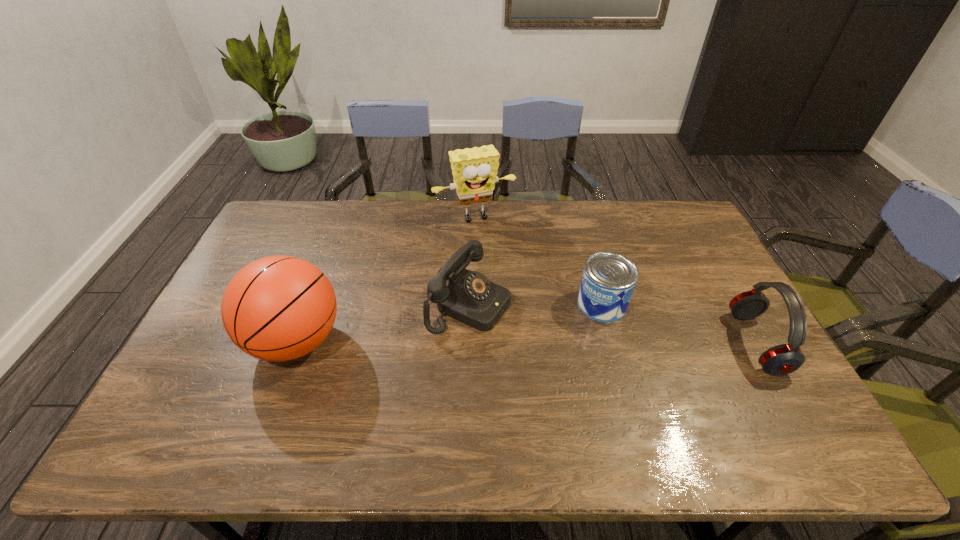
Locate an element on the screen. The width and height of the screenshot is (960, 540). vacant space on the desktop that is between the leftmost object and the earphone and is positioned on the dial of the telephone is located at coordinates (559, 342).

You are a GUI agent. You are given a task and a screenshot of the screen. Output one action in this format:
    pyautogui.click(x=<x>, y=<y>)
    Task: Click on the vacant space on the desktop that is between the basketball and the earphone and is positioned on the front-facing side of the farthest object
    The height and width of the screenshot is (540, 960).
    Given the screenshot: What is the action you would take?
    pyautogui.click(x=536, y=342)

Where is `vacant space on the desktop that is between the leftmost object and the rightmost object and is positioned on the front label of the can`? The image size is (960, 540). vacant space on the desktop that is between the leftmost object and the rightmost object and is positioned on the front label of the can is located at coordinates (531, 342).